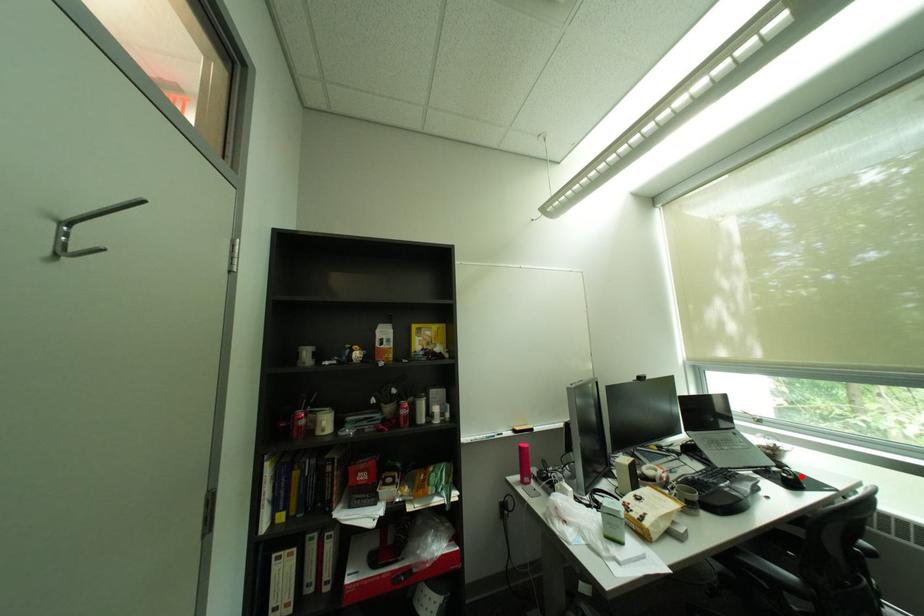
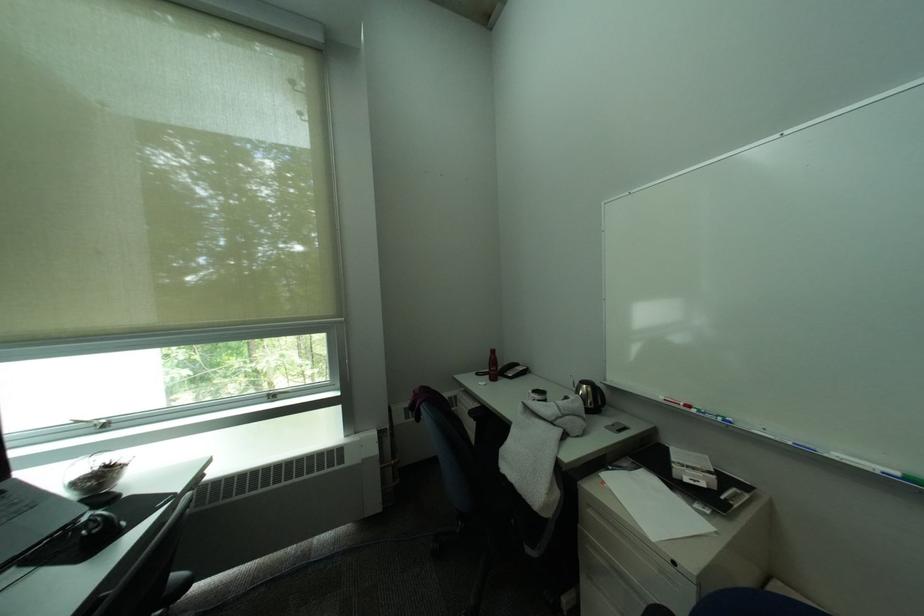
Question: I am providing you with two images of the same scene from different viewpoints. In image1, a red point is highlighted. Considering the same 3D point in image2, which of the following is correct?

Choices:
 (A) It is closer
 (B) It is farther

Answer: (A)